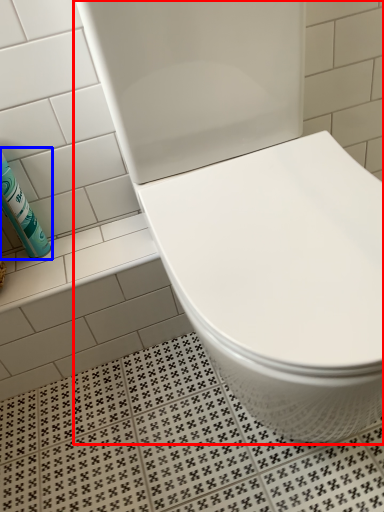
Question: Which object appears farthest to the camera in this image, toilet (highlighted by a red box) or cleaning product (highlighted by a blue box)?

Choices:
 (A) toilet
 (B) cleaning product

Answer: (B)